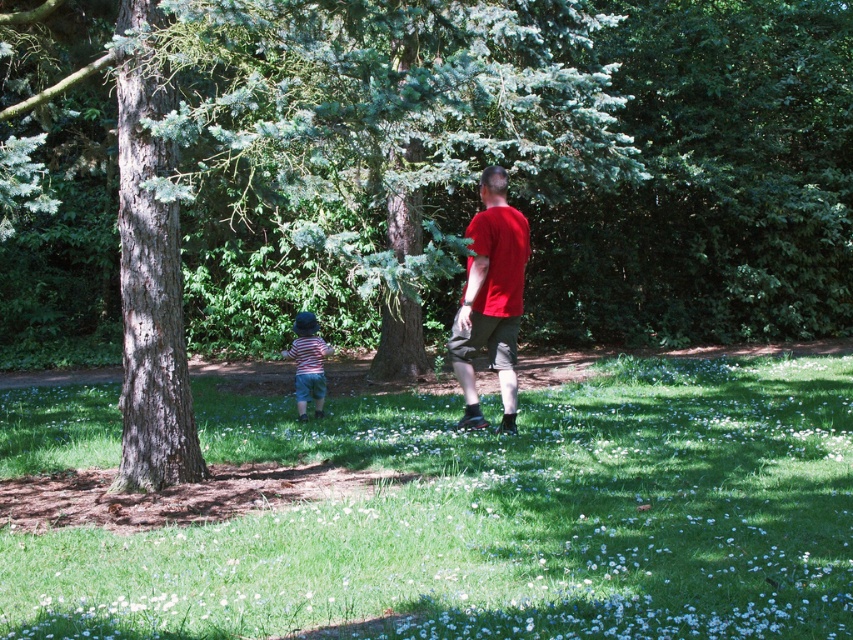
You are standing at the point marked by the coordinates point (149, 275). Looking around, you see a smooth brown tree trunk at left. Which direction should you walk to reach the smooth brown tree trunk at left?

You are already at the location of the smooth brown tree trunk at left, as the coordinates point (149, 275) represent its position.

Looking at this image, you are standing at the point with coordinates point (x=514, y=314) and want to walk to the point with coordinates point (x=426, y=547). Which direction should you move to reach your destination?

You should move forward because point (x=426, y=547) is in front of point (x=514, y=314).